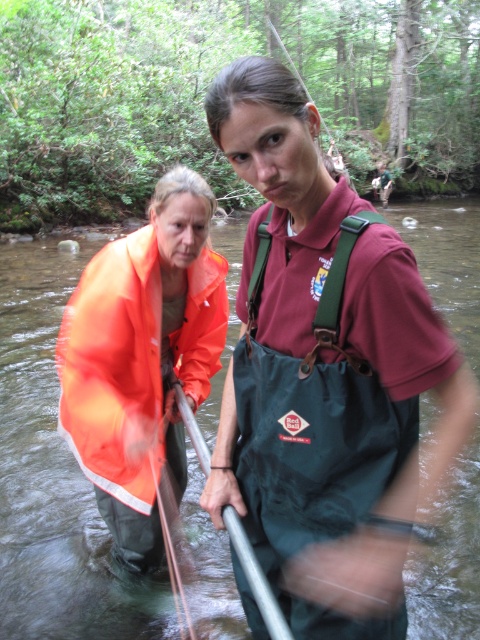
You are observing two points in the image of the stream. Which point, point [358,337] or point [183,420], is nearer to your viewpoint?

Point [358,337] is closer to the camera than point [183,420], so it is nearer to your viewpoint.